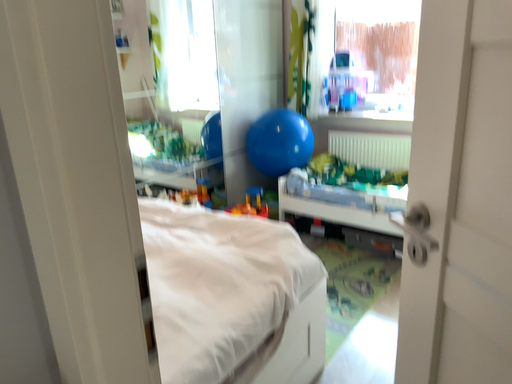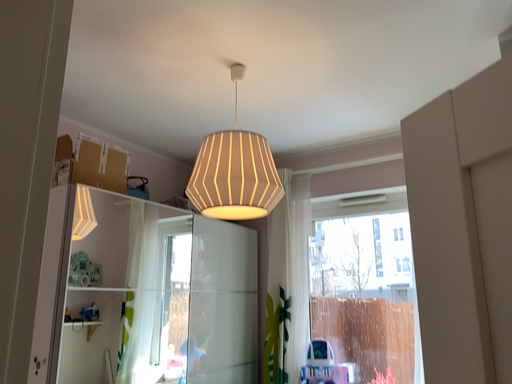
Question: Which way did the camera rotate in the video?

Choices:
 (A) rotated downward
 (B) rotated upward

Answer: (B)